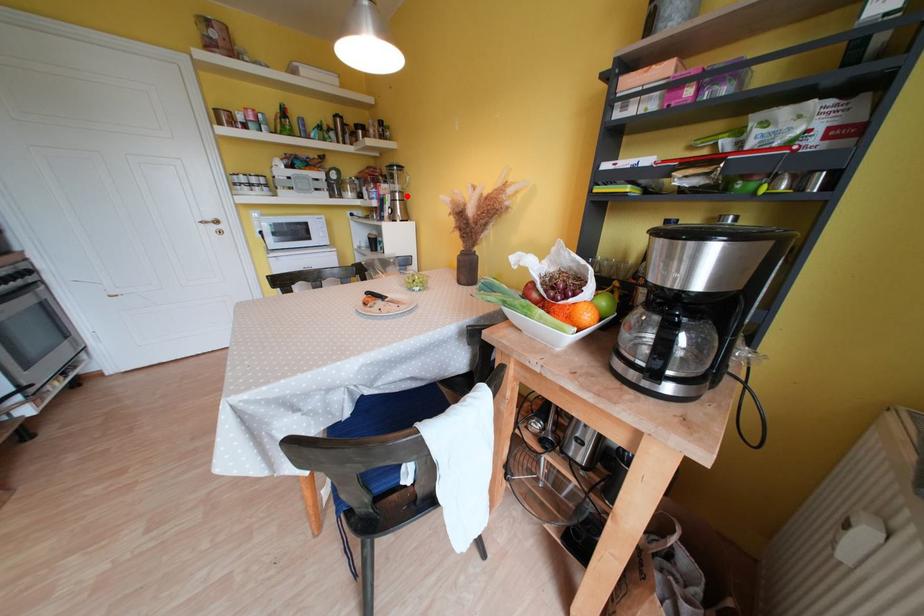
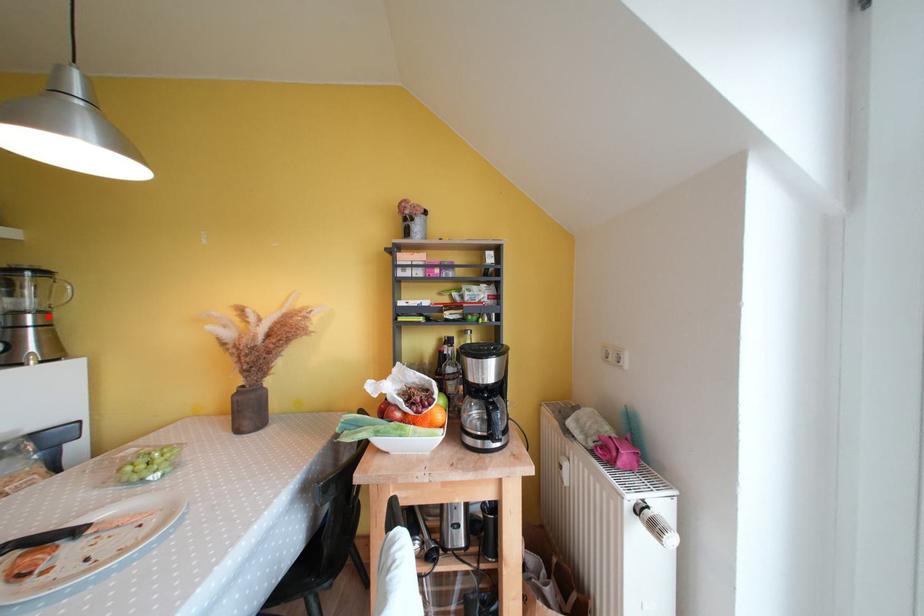
I am providing you with two images of the same scene from different viewpoints. A red point is marked on the first image and another point is marked on the second image. Is the marked point in image1 the same physical position as the marked point in image2?

Yes